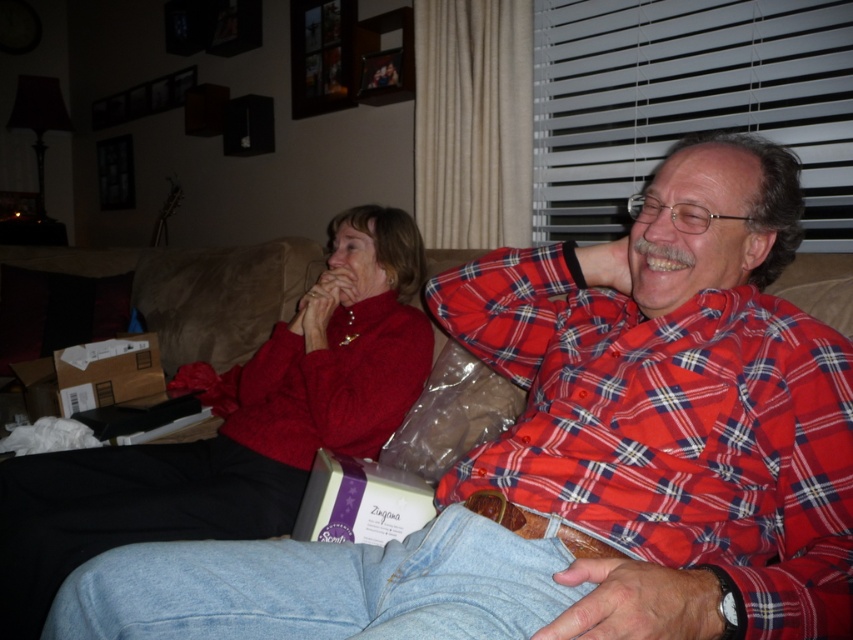
Is red plaid shirt at right to the left of matte red sweater at left from the viewer's perspective?

Incorrect, red plaid shirt at right is not on the left side of matte red sweater at left.

Is red plaid shirt at right positioned in front of matte red sweater at left?

That is True.

Is point (685, 449) positioned in front of point (91, 480)?

That is True.

The width and height of the screenshot is (853, 640). Find the location of `red plaid shirt at right`. red plaid shirt at right is located at coordinates (670, 429).